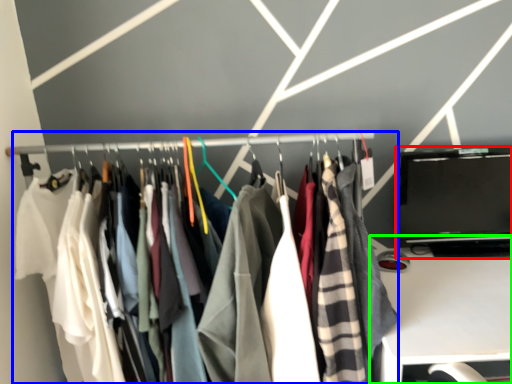
Question: Which object is the closest to the laptop (highlighted by a red box)? Choose among these: closet (highlighted by a blue box) or furniture (highlighted by a green box).

Choices:
 (A) closet
 (B) furniture

Answer: (B)